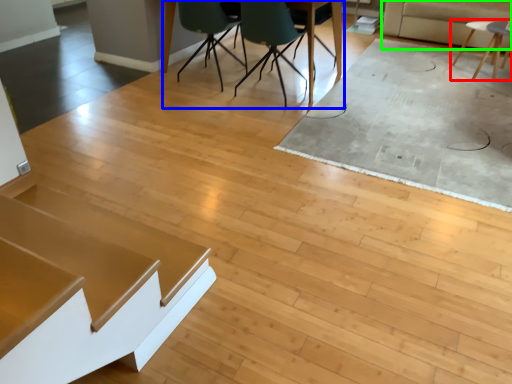
Question: Estimate the real-world distances between objects in this image. Which object is closer to table (highlighted by a red box), table (highlighted by a blue box) or couch (highlighted by a green box)?

Choices:
 (A) table
 (B) couch

Answer: (B)